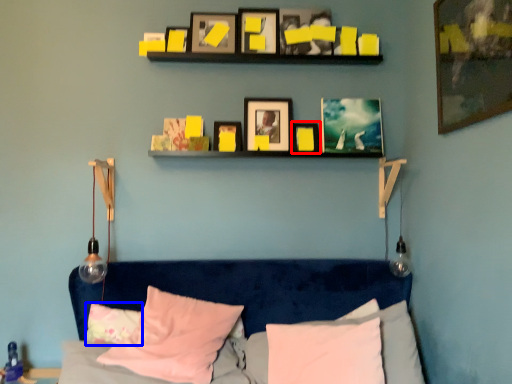
Question: Which of the following is the farthest to the observer, picture frame (highlighted by a red box) or pillow (highlighted by a blue box)?

Choices:
 (A) picture frame
 (B) pillow

Answer: (A)